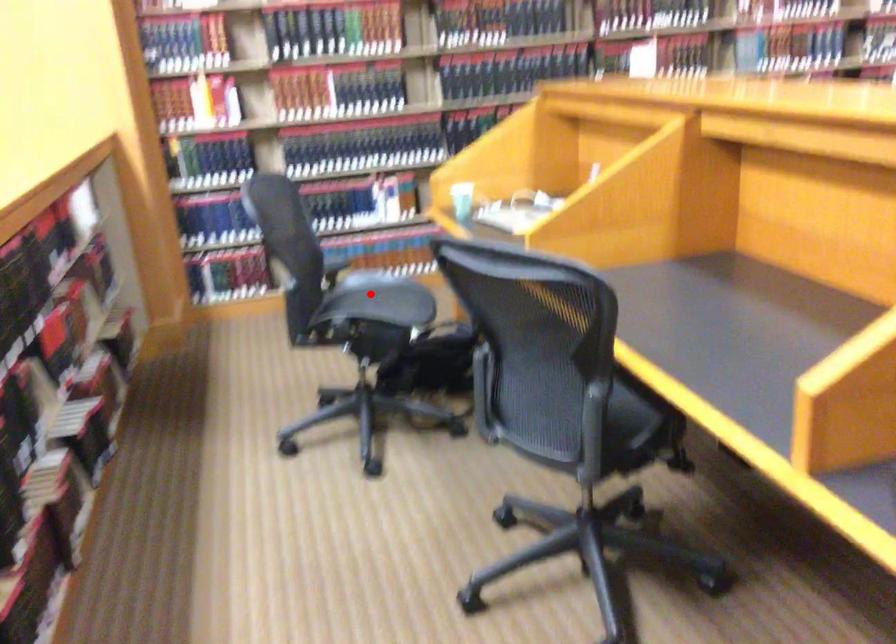
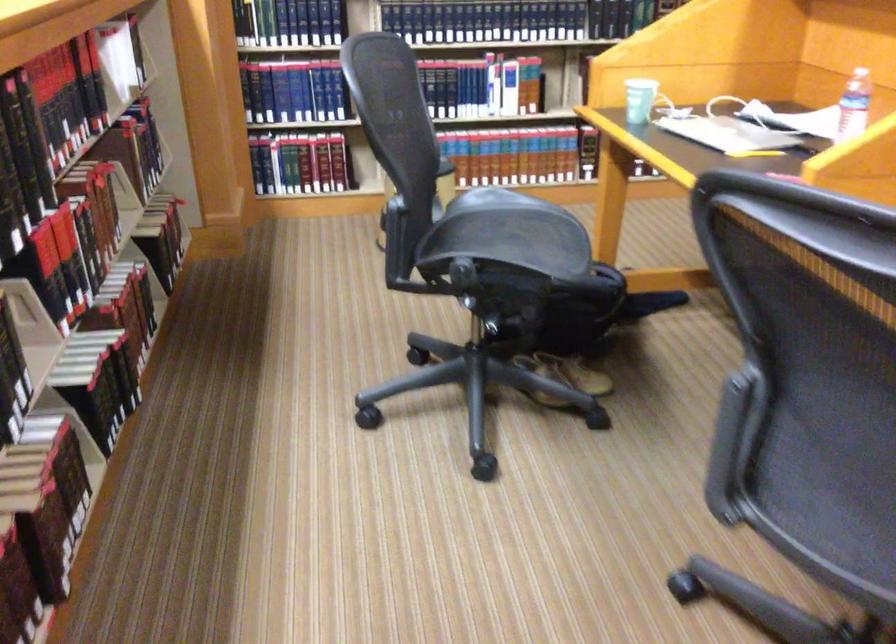
Locate, in the second image, the point that corresponds to the highlighted location in the first image.

(500, 221)